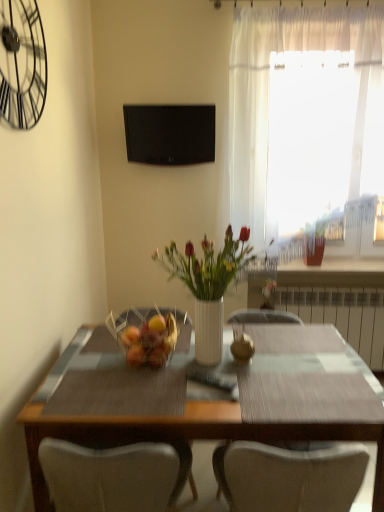
Question: From the image's perspective, is translucent glass basket at center positioned above or below white glossy vase at center?

Choices:
 (A) above
 (B) below

Answer: (B)

Question: Is translucent glass basket at center taller or shorter than white glossy vase at center?

Choices:
 (A) short
 (B) tall

Answer: (A)

Question: Which object is the farthest from the translucent fabric curtain at upper right?

Choices:
 (A) yellow matte apple at center
 (B) wooden table at center
 (C) translucent glass basket at center
 (D) white metallic radiator at right
 (E) black matte television at upper center

Answer: (A)

Question: Estimate the real-world distances between objects in this image. Which object is farther from the white metallic radiator at right?

Choices:
 (A) wooden table at center
 (B) yellow matte apple at center
 (C) black metal clock at upper left
 (D) translucent glass basket at center
 (E) black matte television at upper center

Answer: (C)